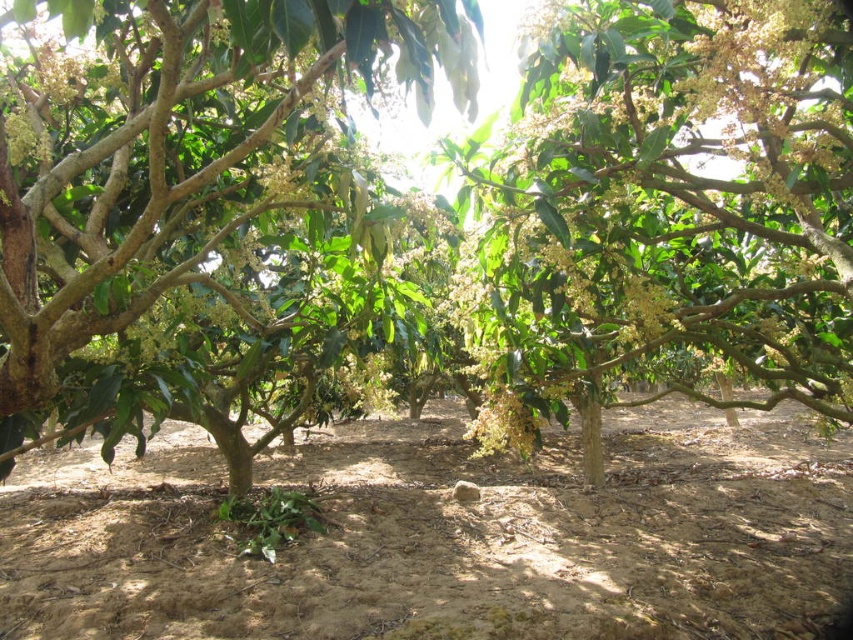
You are standing in the orchard and want to place a small potted plant exactly at the point marked as point [445,536]. According to the scene description, what will be under the potted plant when placed there?

The point [445,536] has brown soil at center underneath, so the potted plant will be placed on the brown soil at center.

You are a gardener who needs to prune the green leafy tree at center and the green glossy tree at upper center. If your ladder can only extend to 1.5 meters, will you be able to reach both trees from your current position?

The distance between the green leafy tree at center and the green glossy tree at upper center is 1.52 meters. Since your ladder can only extend to 1.5 meters, you will not be able to reach both trees from your current position without moving the ladder closer.

You are navigating through the orchard and need to reach a specific location marked by point (558, 436). There is an obstacle at point (439, 3). Can you safely go around the obstacle to reach your destination?

Point (558, 436) is behind point (439, 3), so you can go around the obstacle at point (439, 3) to reach your destination.